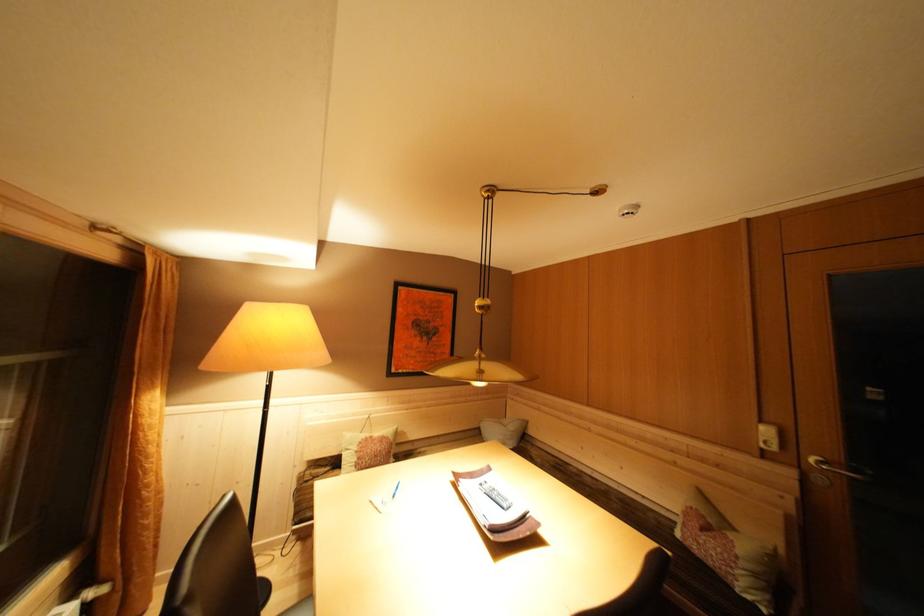
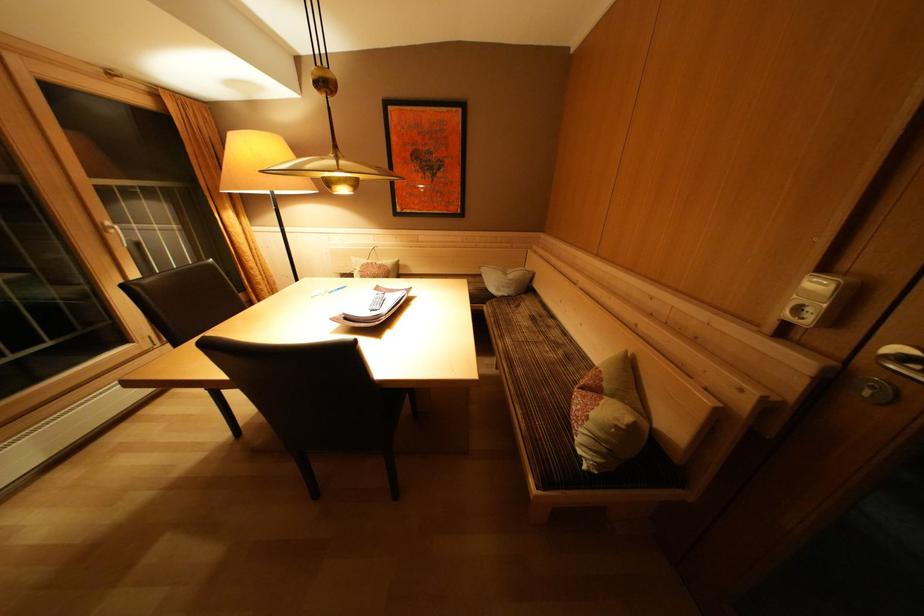
Question: I am providing you with two images of the same scene from different viewpoints. Which of the following objects are not visible in image2?

Choices:
 (A) sofa sitting surface
 (B) grey cushion
 (C) remote control
 (D) none of these

Answer: (D)